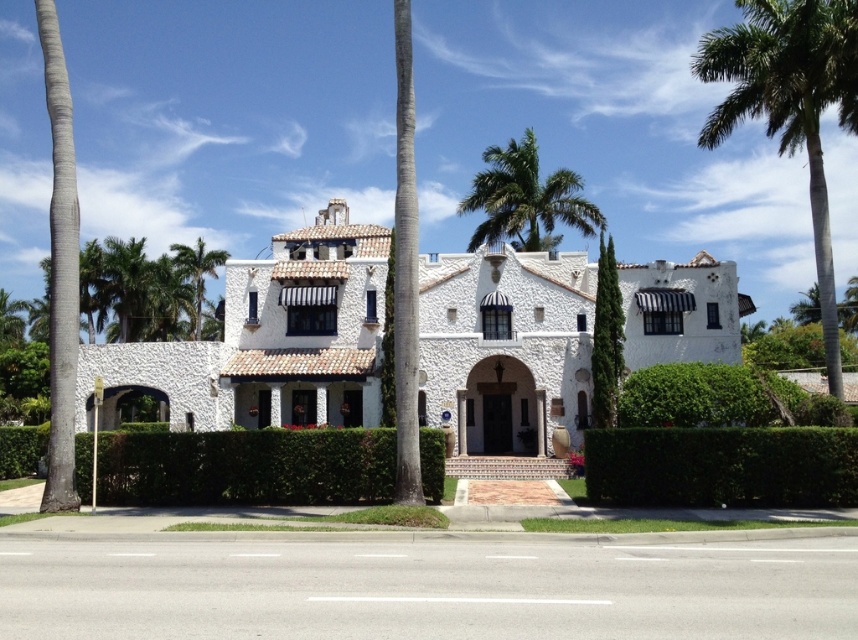
Question: Which of the following is the closest to the observer?

Choices:
 (A) green leafy hedge at lower right
 (B) green leafy hedge at lower center
 (C) white stucco mansion at center
 (D) green leafy palm tree at upper right

Answer: (C)

Question: Considering the real-world distances, which object is closest to the green leafy palm tree at upper center?

Choices:
 (A) green leafy hedge at lower center
 (B) white stucco mansion at center
 (C) green leafy hedge at center

Answer: (B)

Question: Can you confirm if green leafy palm tree at upper center is thinner than green leafy palm tree at upper left?

Choices:
 (A) no
 (B) yes

Answer: (A)

Question: Does green leafy palm tree at upper center have a greater width compared to green leafy palm tree at left?

Choices:
 (A) no
 (B) yes

Answer: (A)

Question: Is green leafy hedge at lower center further to camera compared to green leafy palm tree at upper left?

Choices:
 (A) yes
 (B) no

Answer: (B)

Question: Among these points, which one is farthest from the camera?

Choices:
 (A) (197, 241)
 (B) (0, 444)

Answer: (A)